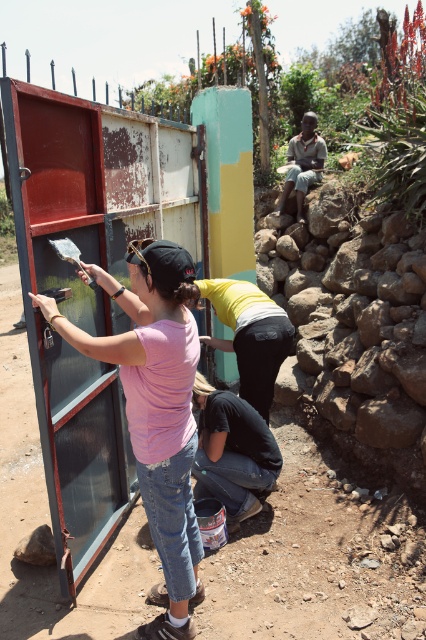
Which is more to the right, pink matte shirt at center or denim jeans at lower center?

From the viewer's perspective, denim jeans at lower center appears more on the right side.

Does pink matte shirt at center come behind denim jeans at lower center?

No.

Between point (157, 333) and point (192, 474), which one is positioned in front?

Point (157, 333) is more forward.

Where is `pink matte shirt at center`? Image resolution: width=426 pixels, height=640 pixels. pink matte shirt at center is located at coordinates (155, 406).

Which is more to the left, denim jeans at lower center or light brown wooden chair at upper center?

Positioned to the left is denim jeans at lower center.

Where is `denim jeans at lower center`? This screenshot has height=640, width=426. denim jeans at lower center is located at coordinates (232, 451).

Identify the location of denim jeans at lower center. The width and height of the screenshot is (426, 640). (232, 451).

Where is `denim jeans at lower center`? The width and height of the screenshot is (426, 640). denim jeans at lower center is located at coordinates (232, 451).

Does pink matte shirt at center have a lesser width compared to light brown wooden chair at upper center?

In fact, pink matte shirt at center might be wider than light brown wooden chair at upper center.

Who is more forward, (143, 298) or (314, 147)?

Point (143, 298) is in front.

You are a GUI agent. You are given a task and a screenshot of the screen. Output one action in this format:
    pyautogui.click(x=<x>, y=<y>)
    Task: Click on the pink matte shirt at center
    
    Given the screenshot: What is the action you would take?
    pyautogui.click(x=155, y=406)